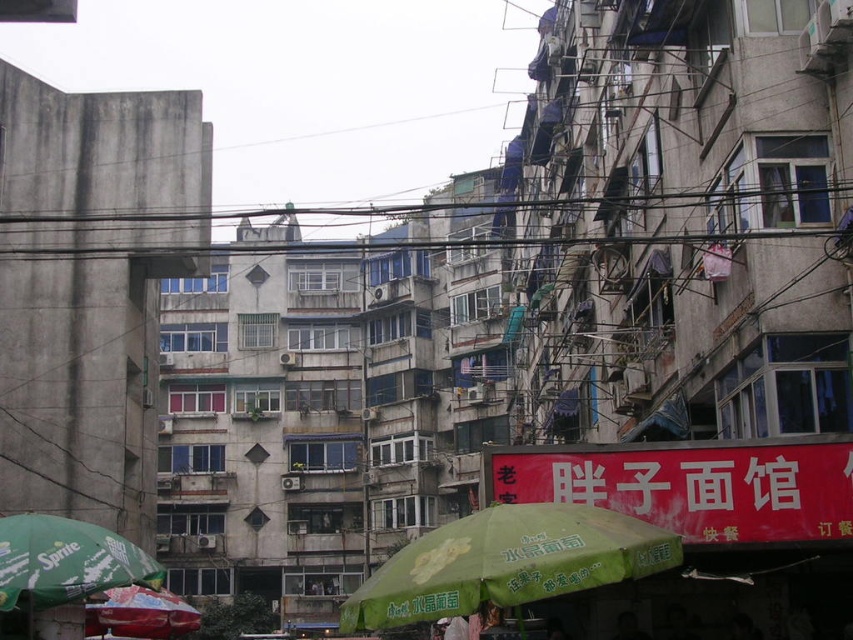
You are a delivery person trying to navigate through the narrow alley between the buildings. You see a green fabric umbrella at center and a black wire at upper center. Which object is closer to the ground?

The green fabric umbrella at center is located below the black wire at upper center, meaning it is closer to the ground than the black wire at upper center.